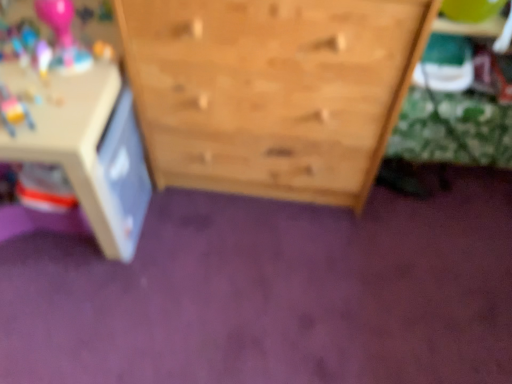
Locate an element on the screen. This screenshot has width=512, height=384. empty space that is to the right of natural wood chest of drawers at center is located at coordinates (430, 228).